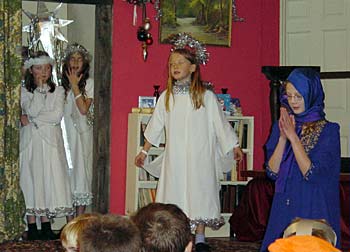
Find the location of a particular element. bookshelves is located at coordinates (248, 128).